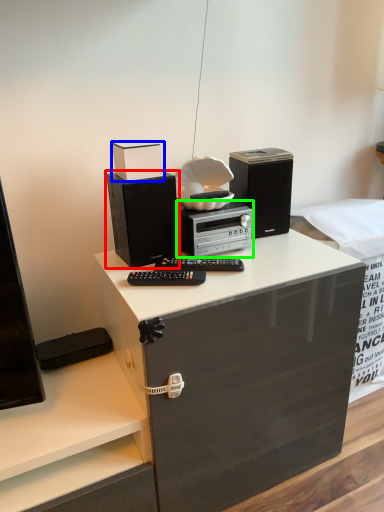
Question: Which object is positioned closest to speaker (highlighted by a red box)? Select from box (highlighted by a blue box) and home appliance (highlighted by a green box).

Choices:
 (A) box
 (B) home appliance

Answer: (B)